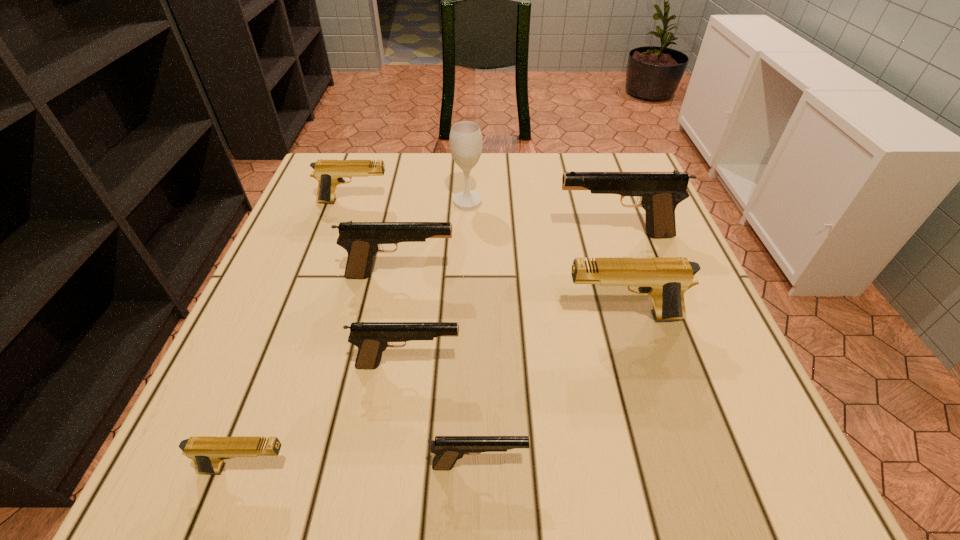
Locate an element on the screen. This screenshot has height=540, width=960. the second nearest black pistol is located at coordinates (372, 338).

The image size is (960, 540). Identify the location of the nearest tan pistol. (208, 453).

At what (x,y) coordinates should I click in order to perform the action: click on the smallest black pistol. Please return your answer as a coordinate pair (x, y). The height and width of the screenshot is (540, 960). Looking at the image, I should click on (448, 449).

This screenshot has height=540, width=960. In order to click on vacant point located on the right of the tallest object in this screenshot , I will do `click(567, 201)`.

Where is `free space located 0.260m at the muzzle of the farthest black pistol`? The image size is (960, 540). free space located 0.260m at the muzzle of the farthest black pistol is located at coordinates (441, 235).

Where is `free space located 0.280m at the muzzle of the farthest black pistol`? The image size is (960, 540). free space located 0.280m at the muzzle of the farthest black pistol is located at coordinates (432, 235).

This screenshot has width=960, height=540. I want to click on free space located 0.140m at the muzzle of the farthest black pistol, so click(493, 235).

Where is `vacant area located at the barrel of the fourth nearest object`? vacant area located at the barrel of the fourth nearest object is located at coordinates (383, 316).

The width and height of the screenshot is (960, 540). Find the location of `free region located 0.280m at the barrel of the fourth nearest object`. free region located 0.280m at the barrel of the fourth nearest object is located at coordinates (415, 316).

Find the location of a particular element. This screenshot has width=960, height=540. vacant space located at the barrel of the fourth nearest object is located at coordinates (499, 316).